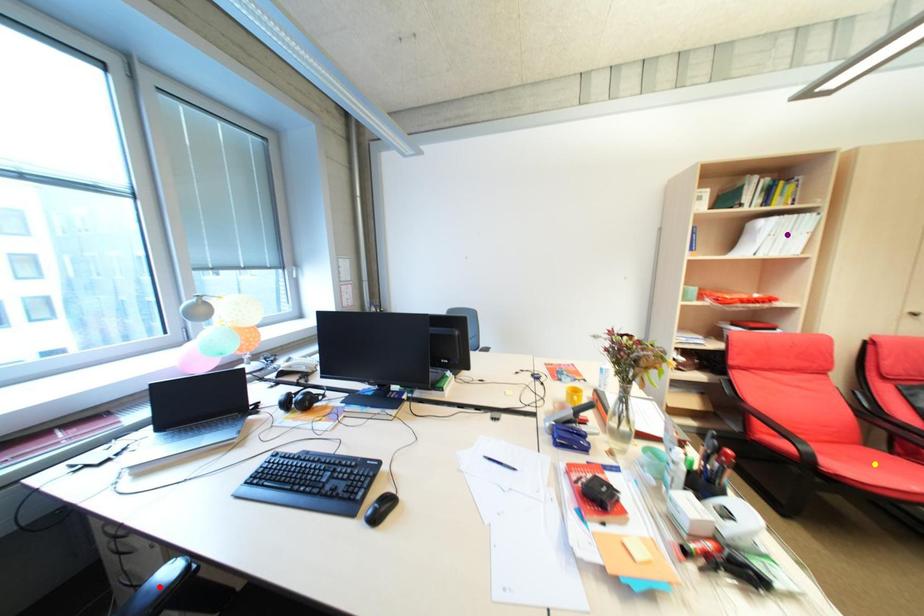
Order these from farthest to nearest:
red point | purple point | yellow point

1. purple point
2. yellow point
3. red point